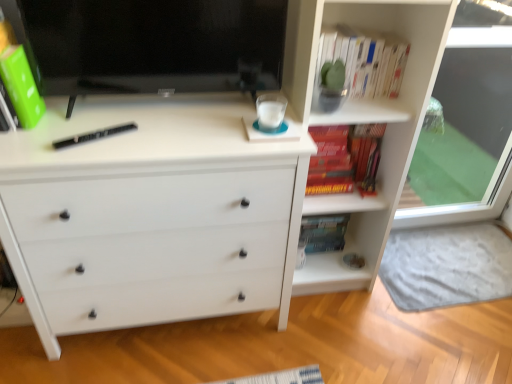
Question: Is black hardback book at center behind hardcover book at upper right, acting as the second book starting from the top?

Choices:
 (A) no
 (B) yes

Answer: (A)

Question: Does black hardback book at center appear on the right side of hardcover book at upper right, acting as the second book starting from the top?

Choices:
 (A) yes
 (B) no

Answer: (B)

Question: Does black hardback book at center have a lesser height compared to hardcover book at upper right, placed as the first book when sorted from bottom to top?

Choices:
 (A) yes
 (B) no

Answer: (A)

Question: Considering the relative sizes of black hardback book at center and hardcover book at upper right, placed as the first book when sorted from bottom to top, in the image provided, is black hardback book at center wider than hardcover book at upper right, placed as the first book when sorted from bottom to top,?

Choices:
 (A) no
 (B) yes

Answer: (B)

Question: Are black hardback book at center and hardcover book at upper right, placed as the first book when sorted from bottom to top, far apart?

Choices:
 (A) no
 (B) yes

Answer: (A)

Question: Would you say white paper book at upper right, which is the first book in top-to-bottom order, is inside or outside hardcover book at upper right, acting as the second book starting from the top?

Choices:
 (A) inside
 (B) outside

Answer: (B)

Question: Would you say white paper book at upper right, which is the first book in top-to-bottom order, is to the left or to the right of hardcover book at upper right, acting as the second book starting from the top, in the picture?

Choices:
 (A) left
 (B) right

Answer: (A)

Question: Does point (332, 39) appear closer or farther from the camera than point (313, 187)?

Choices:
 (A) farther
 (B) closer

Answer: (B)

Question: In terms of width, does white paper book at upper right, which is the second book from bottom to top, look wider or thinner when compared to hardcover book at upper right, acting as the second book starting from the top?

Choices:
 (A) thin
 (B) wide

Answer: (A)

Question: Is white paper book at upper right, which is the second book from bottom to top, wider or thinner than black hardback book at center?

Choices:
 (A) thin
 (B) wide

Answer: (A)

Question: Do you think white paper book at upper right, which is the first book in top-to-bottom order, is within black hardback book at center, or outside of it?

Choices:
 (A) outside
 (B) inside

Answer: (A)

Question: Considering the positions of white paper book at upper right, which is the first book in top-to-bottom order, and black hardback book at center in the image, is white paper book at upper right, which is the first book in top-to-bottom order, taller or shorter than black hardback book at center?

Choices:
 (A) tall
 (B) short

Answer: (A)

Question: From the image's perspective, relative to black hardback book at center, is white paper book at upper right, which is the first book in top-to-bottom order, above or below?

Choices:
 (A) above
 (B) below

Answer: (A)

Question: In terms of width, does matte black monitor at upper left look wider or thinner when compared to white matte chest of drawers at center?

Choices:
 (A) thin
 (B) wide

Answer: (A)

Question: Do you think matte black monitor at upper left is within white matte chest of drawers at center, or outside of it?

Choices:
 (A) inside
 (B) outside

Answer: (B)